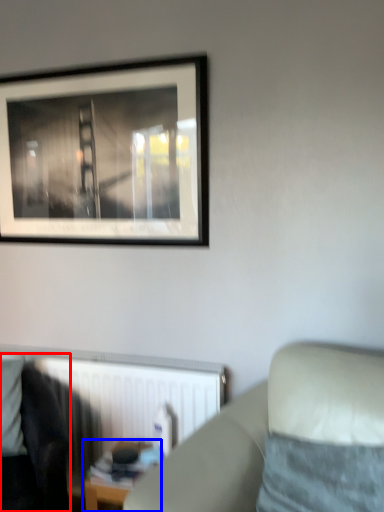
Question: Which object appears farthest to the camera in this image, rocking chair (highlighted by a red box) or table (highlighted by a blue box)?

Choices:
 (A) rocking chair
 (B) table

Answer: (B)